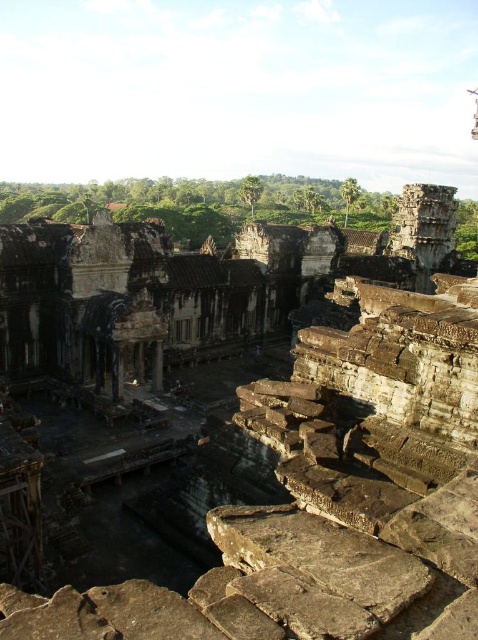
You are an archaeologist examining the brown stone ruins at center and the brown stone pillar at center in the image. Which structure is located higher up in the scene?

The brown stone ruins at center is positioned over the brown stone pillar at center, so it is higher up in the scene.